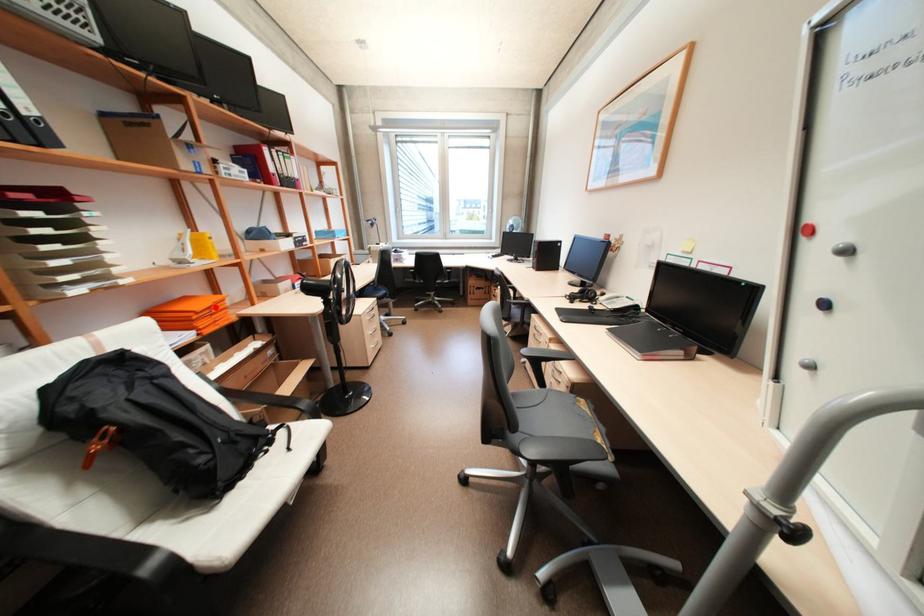
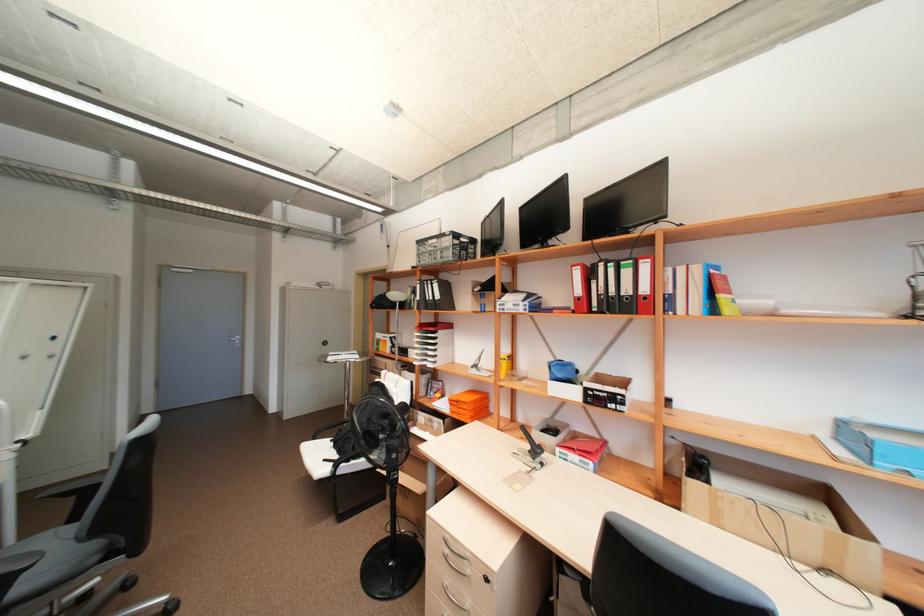
Question: I am providing you with two images of the same scene from different viewpoints. A red point is shown in image1. For the corresponding object point in image2, is it positioned nearer or farther from the camera?

Choices:
 (A) Nearer
 (B) Farther

Answer: (B)